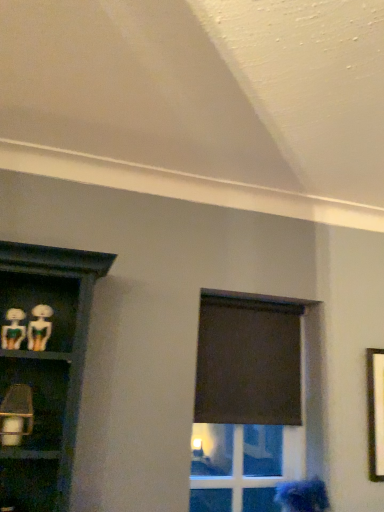
Describe the element at coordinates (303, 496) in the screenshot. I see `blue fabric at lower right, the 1th woman viewed from the right` at that location.

In order to face matte green plastic skeleton at left, the 2th woman viewed from the back, should I rotate leftwards or rightwards?

A 19.531 degree turn to the left will do.

Locate an element on the screen. black matte curtain at upper center is located at coordinates (248, 361).

Find the location of a particular element. The image size is (384, 512). transparent glass door at center is located at coordinates (238, 467).

Is transparent glass door at center positioned beyond the bounds of black matte curtain at upper center?

Yes, transparent glass door at center is located beyond the bounds of black matte curtain at upper center.

How many degrees apart are the facing directions of transparent glass door at center and black matte curtain at upper center?

The facing directions of transparent glass door at center and black matte curtain at upper center are 0.252 degrees apart.

From a real-world perspective, which object rests below the other?

From a 3D spatial view, transparent glass door at center is below.

In the scene shown: Considering the sizes of objects transparent glass door at center and black matte curtain at upper center in the image provided, who is wider, transparent glass door at center or black matte curtain at upper center?

transparent glass door at center.

Which of these two, blue fabric at lower right, arranged as the first woman when viewed from the back, or black matte curtain at upper center, stands taller?

black matte curtain at upper center is taller.

Identify the location of woman below the black matte curtain at upper center (from a real-world perspective). Image resolution: width=384 pixels, height=512 pixels. (303, 496).

Is the depth of blue fabric at lower right, the 1th woman viewed from the right, less than that of black matte curtain at upper center?

Yes, blue fabric at lower right, the 1th woman viewed from the right, is closer to the camera.

From the picture: Does blue fabric at lower right, arranged as the first woman when viewed from the back, appear on the left side of black matte curtain at upper center?

No, blue fabric at lower right, arranged as the first woman when viewed from the back, is not to the left of black matte curtain at upper center.

In the scene shown: Does matte green plastic skeleton at left, which is the 2th woman in front-to-back order, turn towards transparent glass door at center?

No, matte green plastic skeleton at left, which is the 2th woman in front-to-back order, is not aimed at transparent glass door at center.

Which is behind, point (32, 341) or point (289, 438)?

The point (289, 438) is farther.

Is matte green plastic skeleton at left, the 2th woman viewed from the back, closer to camera compared to transparent glass door at center?

Yes, it is in front of transparent glass door at center.

Is transparent glass door at center located within blue fabric at lower right, the 1th woman from the bottom?

Actually, transparent glass door at center is outside blue fabric at lower right, the 1th woman from the bottom.

Could you measure the distance between blue fabric at lower right, the 1th woman from the bottom, and transparent glass door at center?

blue fabric at lower right, the 1th woman from the bottom, is 2.58 meters from transparent glass door at center.

Considering the sizes of objects blue fabric at lower right, the 1th woman viewed from the right, and transparent glass door at center in the image provided, who is shorter, blue fabric at lower right, the 1th woman viewed from the right, or transparent glass door at center?

With less height is blue fabric at lower right, the 1th woman viewed from the right.

At what (x,y) coordinates should I click in order to perform the action: click on glass door above the blue fabric at lower right, arranged as the third woman when viewed from the front (from the image's perspective). Please return your answer as a coordinate pair (x, y). Looking at the image, I should click on (238, 467).

From a real-world perspective, is black matte curtain at upper center located higher than matte green plastic skeleton at left, which is the 2th woman in front-to-back order?

No, from a real-world perspective, black matte curtain at upper center is not on top of matte green plastic skeleton at left, which is the 2th woman in front-to-back order.

Is black matte curtain at upper center located outside matte green plastic skeleton at left, positioned as the second woman in left-to-right order?

That's correct, black matte curtain at upper center is outside of matte green plastic skeleton at left, positioned as the second woman in left-to-right order.

Which is nearer, [295,381] or [43,312]?

Point [295,381] is positioned farther from the camera compared to point [43,312].

Is matte green plastic skeleton at left, which is the 2th woman in front-to-back order, at the back of black matte curtain at upper center?

black matte curtain at upper center is not turned away from matte green plastic skeleton at left, which is the 2th woman in front-to-back order.

Considering the sizes of matte green plastic skeleton at left, positioned as the 3th woman in back-to-front order, and blue fabric at lower right, arranged as the first woman when viewed from the back, in the image, is matte green plastic skeleton at left, positioned as the 3th woman in back-to-front order, wider or thinner than blue fabric at lower right, arranged as the first woman when viewed from the back,?

Clearly, matte green plastic skeleton at left, positioned as the 3th woman in back-to-front order, has less width compared to blue fabric at lower right, arranged as the first woman when viewed from the back.

From the image's perspective, which woman is the 2nd one above the blue fabric at lower right, arranged as the first woman when viewed from the back? Please provide its 2D coordinates.

[(13, 329)]

Is matte green plastic skeleton at left, the first woman from the left, in contact with blue fabric at lower right, the 3th woman viewed from the top?

No, matte green plastic skeleton at left, the first woman from the left, is not with blue fabric at lower right, the 3th woman viewed from the top.

Is point (17, 310) more distant than point (317, 480)?

No, it is not.

From a real-world perspective, between matte green plastic skeleton at left, the first woman from the left, and matte green plastic skeleton at left, which ranks as the 2th woman in bottom-to-top order, who is vertically higher?

matte green plastic skeleton at left, which ranks as the 2th woman in bottom-to-top order, from a real-world perspective.

From the image's perspective, is matte green plastic skeleton at left, positioned as the 3th woman in back-to-front order, above matte green plastic skeleton at left, the 2th woman positioned from the right?

Yes, from the image's perspective, matte green plastic skeleton at left, positioned as the 3th woman in back-to-front order, is over matte green plastic skeleton at left, the 2th woman positioned from the right.

At what (x,y) coordinates should I click in order to perform the action: click on woman above the matte green plastic skeleton at left, which ranks as the 2th woman in bottom-to-top order (from the image's perspective). Please return your answer as a coordinate pair (x, y). Looking at the image, I should click on (13, 329).

Which object is thinner, matte green plastic skeleton at left, which ranks as the 3th woman in right-to-left order, or matte green plastic skeleton at left, which is the 2th woman in front-to-back order?

matte green plastic skeleton at left, which is the 2th woman in front-to-back order, is thinner.

Where is `glass door below the black matte curtain at upper center (from the image's perspective)`? This screenshot has height=512, width=384. glass door below the black matte curtain at upper center (from the image's perspective) is located at coordinates (238, 467).

At what (x,y) coordinates should I click in order to perform the action: click on curtain on the left of blue fabric at lower right, the third woman when ordered from left to right. Please return your answer as a coordinate pair (x, y). The height and width of the screenshot is (512, 384). Looking at the image, I should click on (248, 361).

Considering their positions, is matte green plastic skeleton at left, which ranks as the 2th woman in bottom-to-top order, positioned closer to matte green plastic skeleton at left, the 1th woman when ordered from top to bottom, than black matte curtain at upper center?

The object closer to matte green plastic skeleton at left, the 1th woman when ordered from top to bottom, is matte green plastic skeleton at left, which ranks as the 2th woman in bottom-to-top order.

Looking at the image, which one is located closer to blue fabric at lower right, the 3th woman viewed from the top, matte green plastic skeleton at left, which ranks as the 3th woman in right-to-left order, or transparent glass door at center?

The object closer to blue fabric at lower right, the 3th woman viewed from the top, is matte green plastic skeleton at left, which ranks as the 3th woman in right-to-left order.

From the image, which object appears to be farther from blue fabric at lower right, the third woman when ordered from left to right, black matte curtain at upper center or transparent glass door at center?

Among the two, transparent glass door at center is located further to blue fabric at lower right, the third woman when ordered from left to right.

From the image, which object appears to be farther from transparent glass door at center, blue fabric at lower right, the third woman when ordered from left to right, or matte green plastic skeleton at left, positioned as the 3th woman in back-to-front order?

Among the two, matte green plastic skeleton at left, positioned as the 3th woman in back-to-front order, is located further to transparent glass door at center.

Which object lies further to the anchor point blue fabric at lower right, the 1th woman viewed from the right, black matte curtain at upper center or matte green plastic skeleton at left, which is the 2th woman in front-to-back order?

Based on the image, matte green plastic skeleton at left, which is the 2th woman in front-to-back order, appears to be further to blue fabric at lower right, the 1th woman viewed from the right.

When comparing their distances from blue fabric at lower right, arranged as the third woman when viewed from the front, does matte green plastic skeleton at left, the 2th woman viewed from the back, or transparent glass door at center seem further?

transparent glass door at center is further to blue fabric at lower right, arranged as the third woman when viewed from the front.

Considering their positions, is matte green plastic skeleton at left, which is the 2th woman in front-to-back order, positioned further to transparent glass door at center than blue fabric at lower right, the 3th woman viewed from the top?

Among the two, matte green plastic skeleton at left, which is the 2th woman in front-to-back order, is located further to transparent glass door at center.

Considering their positions, is black matte curtain at upper center positioned closer to transparent glass door at center than blue fabric at lower right, the 3th woman viewed from the top?

black matte curtain at upper center.

Where is `woman between matte green plastic skeleton at left, which ranks as the 3th woman in right-to-left order, and transparent glass door at center`? woman between matte green plastic skeleton at left, which ranks as the 3th woman in right-to-left order, and transparent glass door at center is located at coordinates (39, 327).

Where is `curtain between matte green plastic skeleton at left, the 1th woman when ordered from top to bottom, and blue fabric at lower right, arranged as the third woman when viewed from the front, from left to right`? curtain between matte green plastic skeleton at left, the 1th woman when ordered from top to bottom, and blue fabric at lower right, arranged as the third woman when viewed from the front, from left to right is located at coordinates (248, 361).

Locate an element on the screen. glass door that lies between black matte curtain at upper center and blue fabric at lower right, the third woman when ordered from left to right, from top to bottom is located at coordinates [238, 467].

The image size is (384, 512). What are the coordinates of `glass door between matte green plastic skeleton at left, the first woman from the left, and blue fabric at lower right, the 1th woman from the bottom` in the screenshot? It's located at (238, 467).